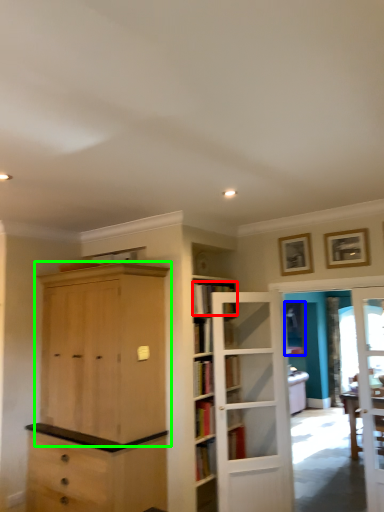
Question: Which object is positioned farthest from book (highlighted by a red box)? Select from window (highlighted by a blue box) and cabinetry (highlighted by a green box).

Choices:
 (A) window
 (B) cabinetry

Answer: (A)